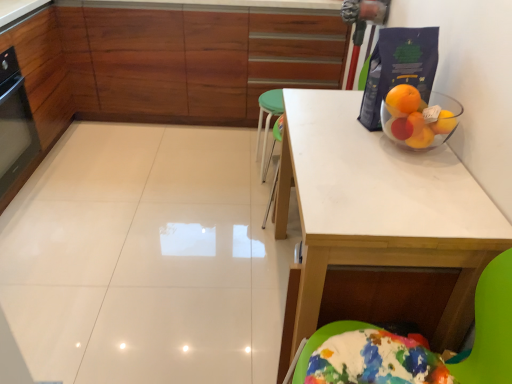
Question: Is there a large distance between white matte table at upper right and black glass oven at left?

Choices:
 (A) no
 (B) yes

Answer: (B)

Question: Considering the relative sizes of white matte table at upper right and black glass oven at left in the image provided, is white matte table at upper right bigger than black glass oven at left?

Choices:
 (A) yes
 (B) no

Answer: (A)

Question: Can you confirm if white matte table at upper right is wider than black glass oven at left?

Choices:
 (A) yes
 (B) no

Answer: (A)

Question: Is the position of white matte table at upper right more distant than that of black glass oven at left?

Choices:
 (A) yes
 (B) no

Answer: (B)

Question: From the image's perspective, is white matte table at upper right on top of black glass oven at left?

Choices:
 (A) no
 (B) yes

Answer: (A)

Question: Can you confirm if white matte table at upper right is taller than black glass oven at left?

Choices:
 (A) yes
 (B) no

Answer: (A)

Question: From a real-world perspective, is white matte table at upper right under wooden cabinet at upper center?

Choices:
 (A) yes
 (B) no

Answer: (A)

Question: Can you confirm if white matte table at upper right is shorter than wooden cabinet at upper center?

Choices:
 (A) yes
 (B) no

Answer: (A)

Question: Considering the relative sizes of white matte table at upper right and wooden cabinet at upper center in the image provided, is white matte table at upper right bigger than wooden cabinet at upper center?

Choices:
 (A) yes
 (B) no

Answer: (B)

Question: Does white matte table at upper right appear on the left side of wooden cabinet at upper center?

Choices:
 (A) no
 (B) yes

Answer: (A)

Question: Is white matte table at upper right to the right of wooden cabinet at upper center from the viewer's perspective?

Choices:
 (A) yes
 (B) no

Answer: (A)

Question: Can you confirm if white matte table at upper right is smaller than wooden cabinet at upper center?

Choices:
 (A) no
 (B) yes

Answer: (B)

Question: Can you confirm if black glass oven at left is thinner than white matte table at upper right?

Choices:
 (A) no
 (B) yes

Answer: (B)